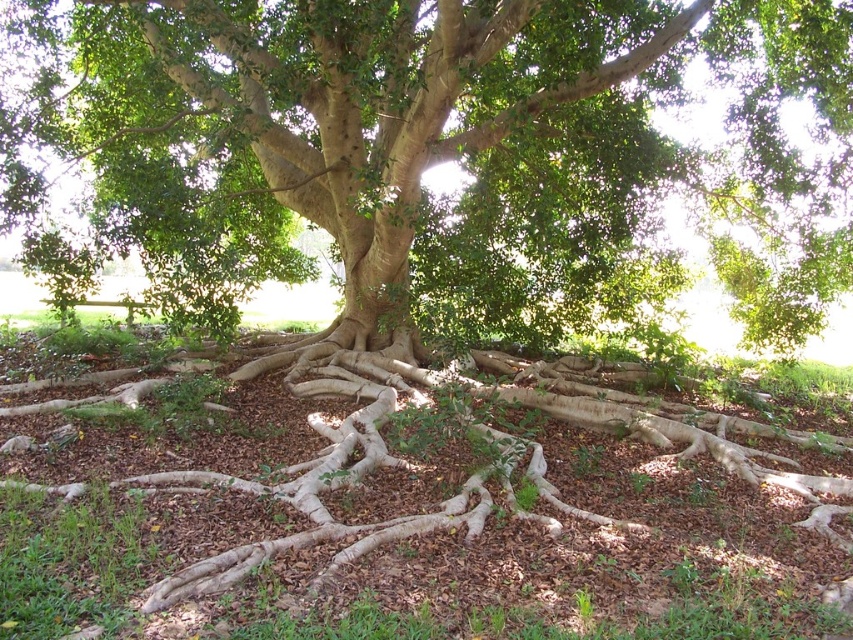
Consider the image. You are standing in a garden and want to place a new flower pot in front of the green matte tree at center so it can be seen clearly. Where should you place the flower pot relative to the brown mulch at center?

You should place the flower pot in front of the brown mulch at center because the brown mulch at center is behind the green matte tree at center, so placing the flower pot in front of the brown mulch at center will position it in front of the tree, making it visible.

You are planning to place a small garden bench in this area. Considering the green matte tree at center and the brown mulch at center, which object would you need to consider in terms of space availability for the bench?

The green matte tree at center has a larger size compared to the brown mulch at center, so you should consider the space occupied by the green matte tree at center when placing the bench to ensure there is enough room.

You are a gardener planning to water the green matte tree at center and the brown mulch at center. You have a watering can that can cover a 20 feet radius. Can you water both areas without moving the watering can?

The green matte tree at center and brown mulch at center are 23.04 feet apart. Since the watering can can only cover 20 feet, you cannot water both areas without moving the watering can because the distance between them exceeds the coverage range.